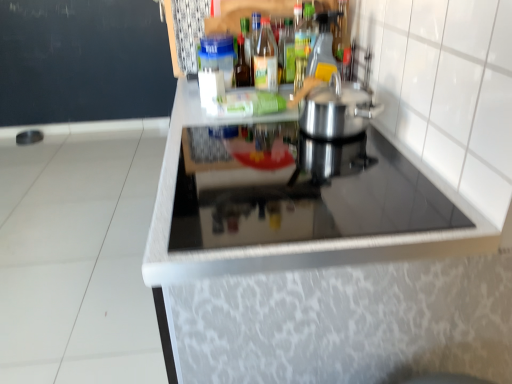
Where is `vacant space situated on the left part of translucent plastic bottle at upper center, which appears as the 2th bottle when viewed from the left`? This screenshot has height=384, width=512. vacant space situated on the left part of translucent plastic bottle at upper center, which appears as the 2th bottle when viewed from the left is located at coordinates (200, 92).